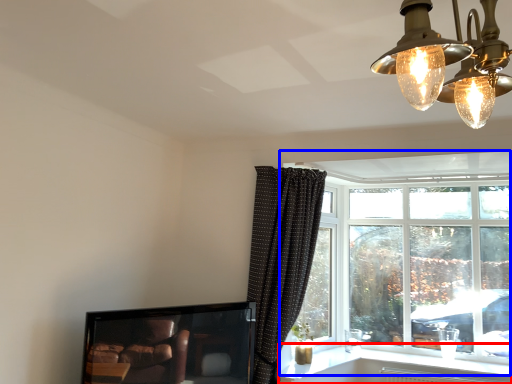
Question: Which of the following is the farthest to the observer, window sill (highlighted by a red box) or window (highlighted by a blue box)?

Choices:
 (A) window sill
 (B) window

Answer: (B)